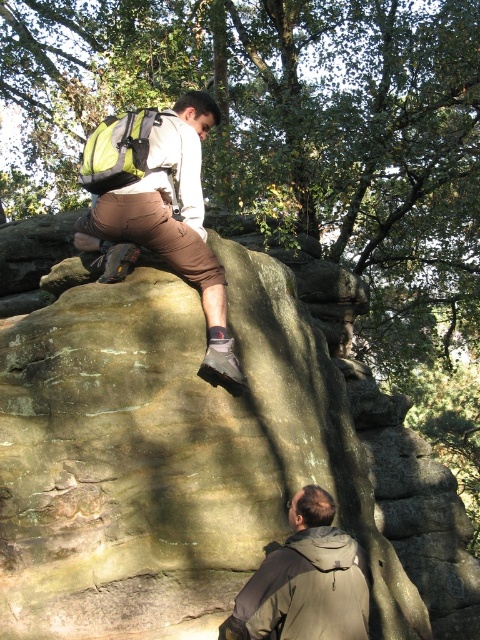
From the picture: You are a photographer taking a picture of the rock climbing scene. You want to ensure both the matte brown pants at upper center and the khaki fabric jacket at lower right are clearly visible in the frame. Based on their sizes, which one might require you to adjust your camera focus more carefully to avoid blurriness?

The matte brown pants at upper center is much taller than the khaki fabric jacket at lower right, so it might require more careful focus adjustment due to its larger size in the frame.

You are a photographer planning to take a wide shot of the climbing scene. You need to ensure both the matte brown pants at upper center and the green fabric safety vest at upper left are clearly visible. Given their widths, which object might require more careful framing to avoid being obscured by other elements?

The matte brown pants at upper center has a lesser width compared to the green fabric safety vest at upper left. Since it is narrower, the matte brown pants at upper center might require more careful framing to avoid being obscured by other elements.